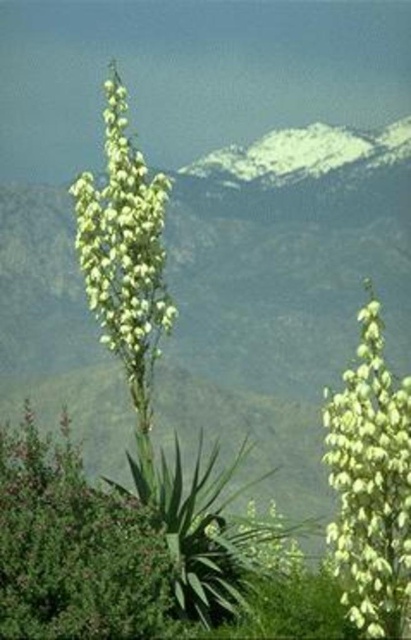
You are a gardener planning to prune the green leafy bush at center and the white matte flower at right. Which object is closer to you, the gardener, when you are standing in front of the scene?

The green leafy bush at center is closer to you since the white matte flower at right is positioned behind it.

Based on the photo, you are standing in the natural landscape and want to pick the white matte flower at right. Which direction should you move relative to the green leafy bush at center to reach it?

You should move to the right of the green leafy bush at center to reach the white matte flower at right since the green leafy bush at center is to the left of the white matte flower at right.

From the picture: You are a gardener who wants to plant a new shrub in your garden. You have two options in the image, the green leafy bush at center and the green leafy plant at center. Which one has a wider spread when fully grown?

The green leafy bush at center has a wider spread when fully grown since its width is larger than the green leafy plant at center.